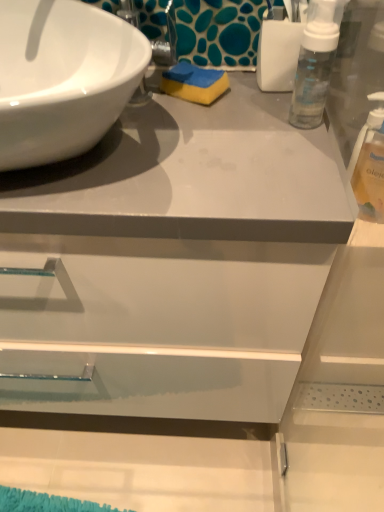
Question: Is clear plastic bottle at right taller or shorter than blue/yellow sponge at center?

Choices:
 (A) tall
 (B) short

Answer: (A)

Question: Does point (377, 138) appear closer or farther from the camera than point (210, 69)?

Choices:
 (A) closer
 (B) farther

Answer: (B)

Question: Estimate the real-world distances between objects in this image. Which object is closer to the white glossy sink at upper left?

Choices:
 (A) blue/yellow sponge at center
 (B) clear plastic bottle at right

Answer: (A)

Question: Estimate the real-world distances between objects in this image. Which object is closer to the blue/yellow sponge at center?

Choices:
 (A) white glossy sink at upper left
 (B) clear plastic bottle at right

Answer: (A)